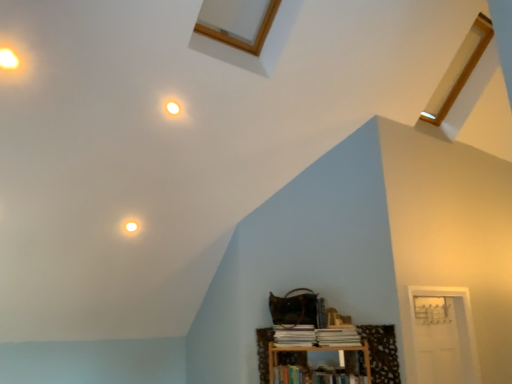
Question: From the image's perspective, relative to hardcover book at lower center, the third book in the top-to-bottom sequence, is wooden bookshelf at lower right above or below?

Choices:
 (A) above
 (B) below

Answer: (A)

Question: Is wooden bookshelf at lower right bigger or smaller than hardcover book at lower center, the third book in the top-to-bottom sequence?

Choices:
 (A) big
 (B) small

Answer: (B)

Question: Estimate the real-world distances between objects in this image. Which object is farther from the wooden bookshelf at lower right?

Choices:
 (A) white glossy light fixture at upper left, placed as the first dot when sorted from left to right
 (B) hardcover book at lower center, the third book in the top-to-bottom sequence
 (C) white paper book at lower center, which is the 1th book from top to bottom
 (D) white glossy light fixture at upper center, arranged as the 2th dot when viewed from the left
 (E) white paper book at lower center, marked as the second book in a top-to-bottom arrangement

Answer: (A)

Question: Which object is the closest to the white glossy light fixture at upper left, arranged as the second dot when ordered from the bottom?

Choices:
 (A) white glossy light at upper center
 (B) white glossy light fixture at upper center, acting as the 1th dot starting from the right
 (C) white paper book at lower center, which is the 1th book from top to bottom
 (D) wooden bookshelf at lower right
 (E) hardcover book at lower center, the third book in the top-to-bottom sequence

Answer: (B)